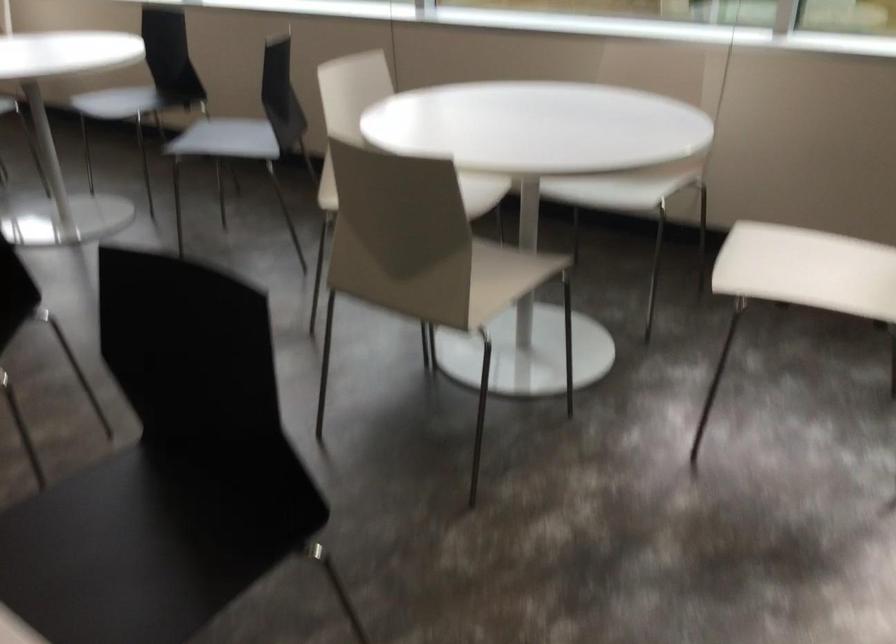
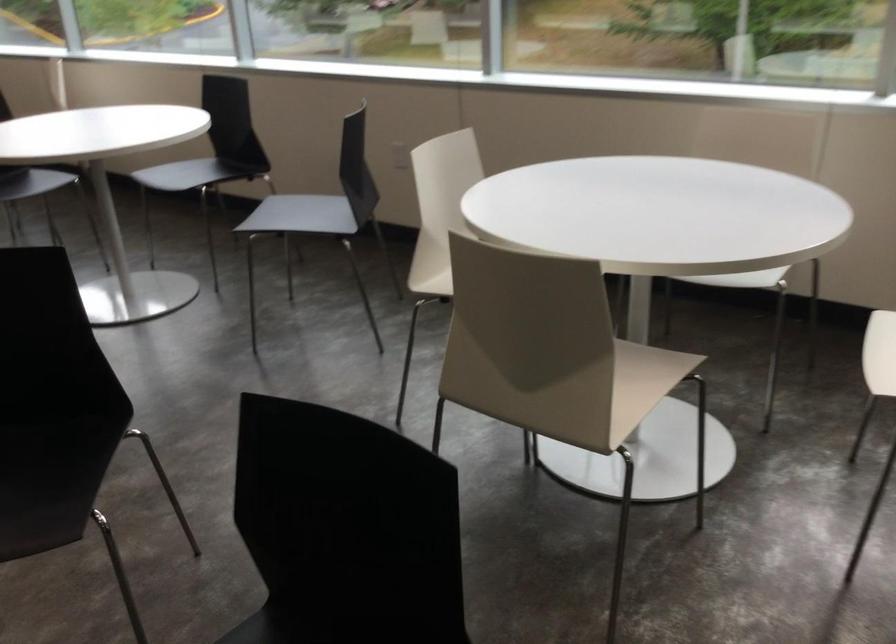
What movement of the cameraman would produce the second image?

The cameraman walked toward left, forward.